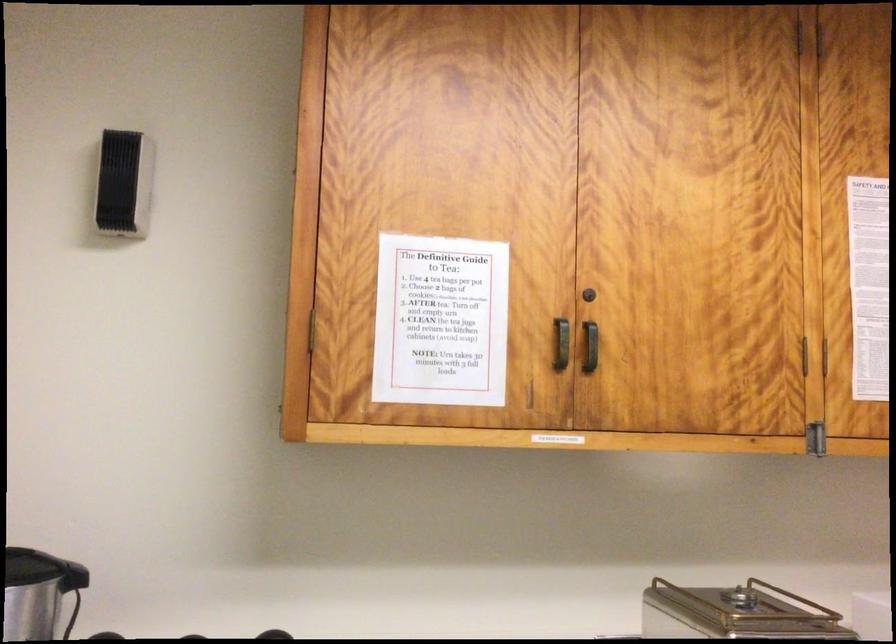
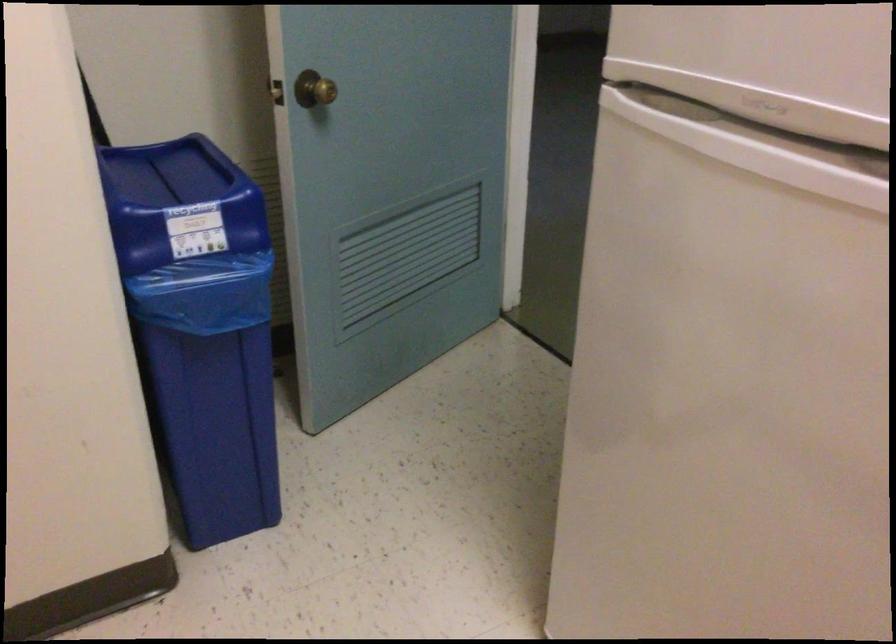
Based on the photo, the first image is from the beginning of the video and the second image is from the end. How did the camera likely rotate when shooting the video?

The camera rotated toward right-down.